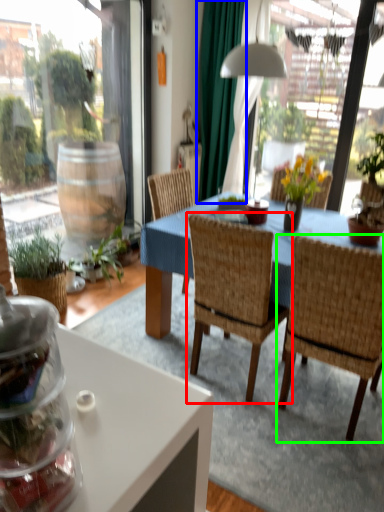
Question: Which is farther away from chair (highlighted by a red box)? curtain (highlighted by a blue box) or chair (highlighted by a green box)?

Choices:
 (A) curtain
 (B) chair

Answer: (A)